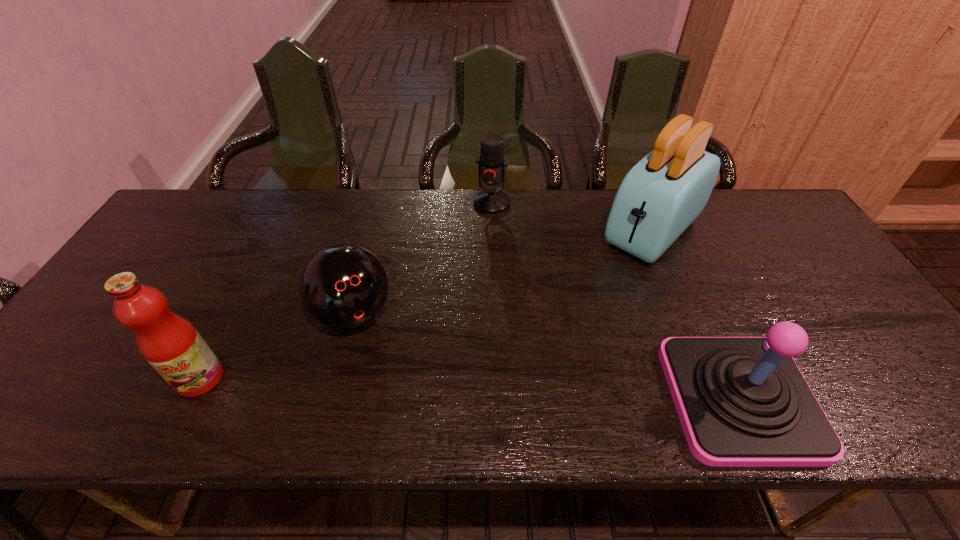
The height and width of the screenshot is (540, 960). Find the location of `vacant point at the left edge`. vacant point at the left edge is located at coordinates (64, 353).

This screenshot has width=960, height=540. Find the location of `vacant space at the near left corner of the desktop`. vacant space at the near left corner of the desktop is located at coordinates (56, 371).

Where is `vacant space that is in between the third object from left to right and the toaster`? vacant space that is in between the third object from left to right and the toaster is located at coordinates (571, 217).

The image size is (960, 540). Find the location of `free space between the toaster and the microphone`. free space between the toaster and the microphone is located at coordinates (571, 217).

Identify the location of free space between the joystick and the microphone. (615, 301).

The image size is (960, 540). In order to click on free area in between the toaster and the bowling ball in this screenshot , I will do `click(503, 273)`.

I want to click on vacant area that lies between the bowling ball and the toaster, so click(503, 273).

At what (x,y) coordinates should I click in order to perform the action: click on empty space between the fruit juice and the bowling ball. Please return your answer as a coordinate pair (x, y). Looking at the image, I should click on (276, 346).

At what (x,y) coordinates should I click in order to perform the action: click on unoccupied position between the leftmost object and the bowling ball. Please return your answer as a coordinate pair (x, y). This screenshot has height=540, width=960. Looking at the image, I should click on (276, 346).

Locate an element on the screen. free area in between the fruit juice and the toaster is located at coordinates coord(426,305).